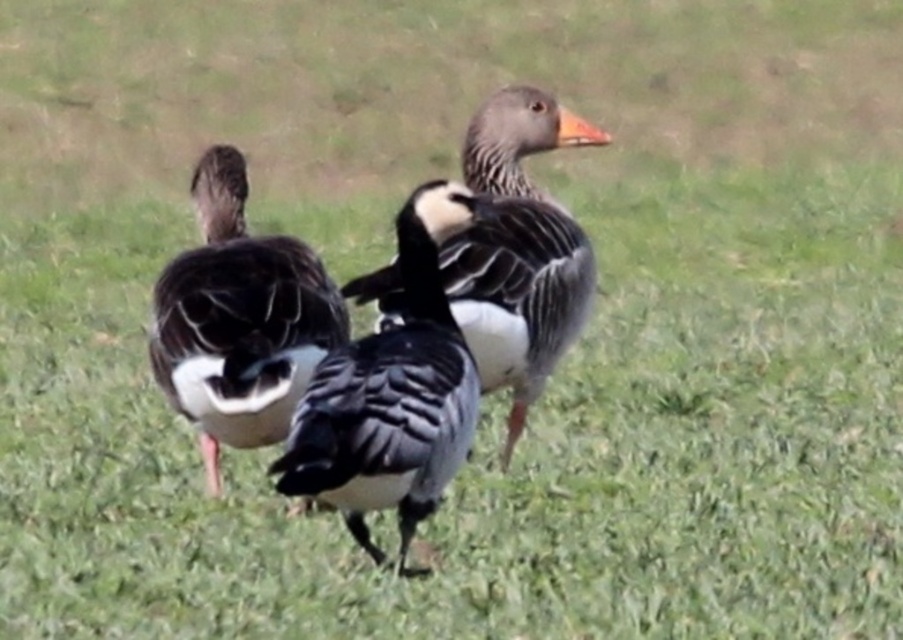
Question: Which of the following is the closest to the observer?

Choices:
 (A) dark gray feathers at center
 (B) gray matte goose at center
 (C) black glossy duck at center

Answer: (C)

Question: Is black glossy duck at center bigger than gray matte goose at center?

Choices:
 (A) no
 (B) yes

Answer: (A)

Question: Is dark gray feathers at center to the left of gray matte goose at center from the viewer's perspective?

Choices:
 (A) no
 (B) yes

Answer: (B)

Question: Where is black glossy duck at center located in relation to gray matte goose at center in the image?

Choices:
 (A) below
 (B) above

Answer: (A)

Question: Which is nearer to the gray matte goose at center?

Choices:
 (A) dark gray feathers at center
 (B) black glossy duck at center

Answer: (B)

Question: Among these points, which one is farthest from the camera?

Choices:
 (A) (259, 262)
 (B) (566, 284)

Answer: (B)